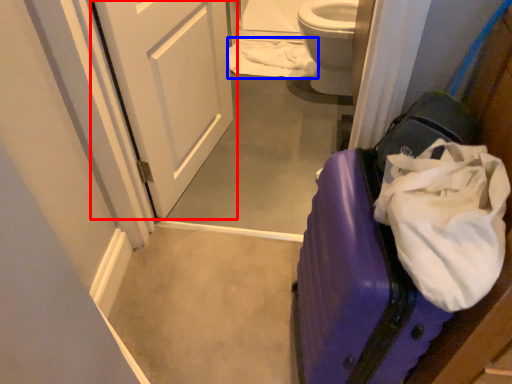
Question: Which object is further to the camera taking this photo, door (highlighted by a red box) or toilet paper (highlighted by a blue box)?

Choices:
 (A) door
 (B) toilet paper

Answer: (B)